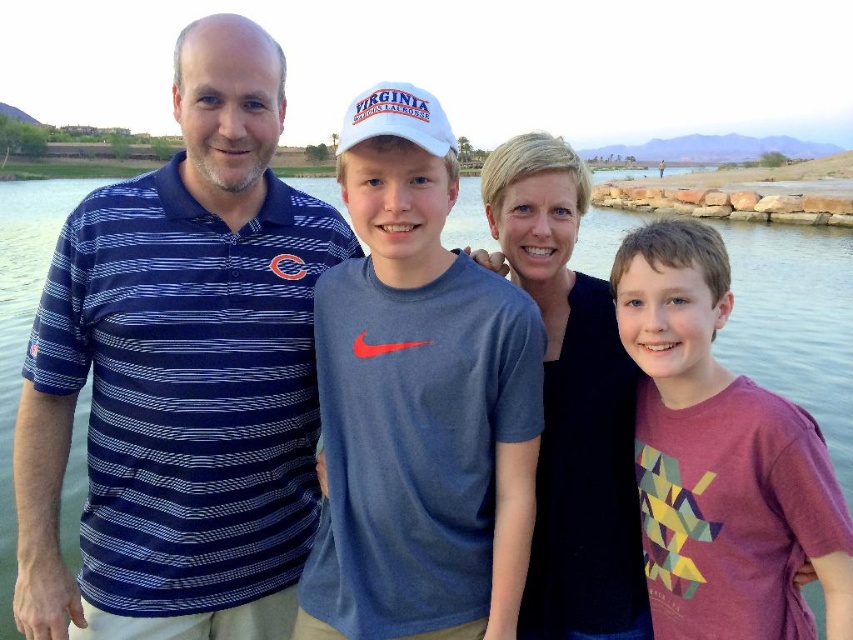
You are a photographer standing at the center of the scene. You want to take a photo that includes both point (573, 608) and point (451, 220). Which point should you focus on to ensure both are in sharp focus?

You should focus on point (451, 220) because it is farther from the camera than point (573, 608). By focusing on the farther point, the depth of field will include the closer point as well, ensuring both are in sharp focus.

You are a photographer trying to capture a clear reflection of the black matte shirt at center in the clear water at center. Based on their heights, will the reflection be visible?

The black matte shirt at center is not as tall as clear water at center, so the reflection of the black matte shirt at center may not be fully visible in the clear water at center because the water is taller than the shirt.